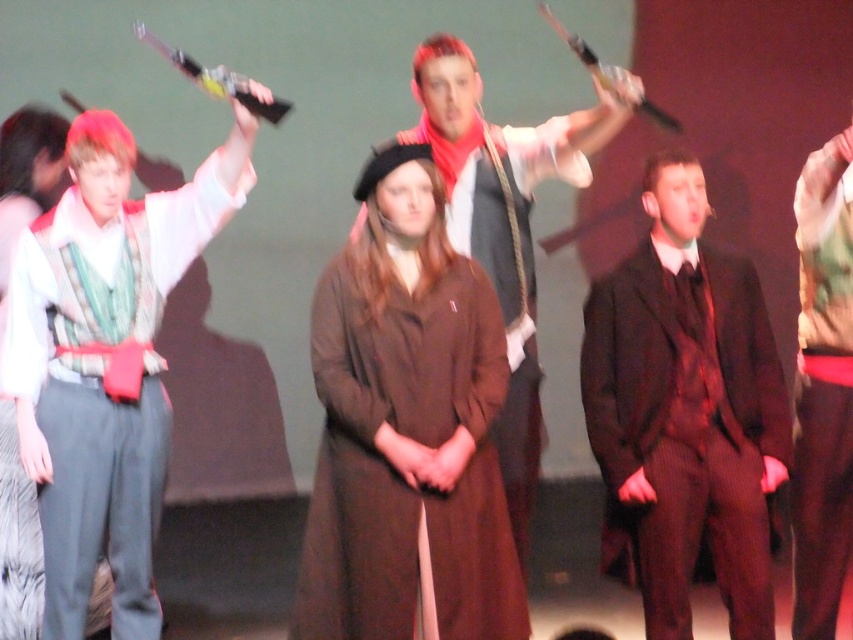
I want to click on matte green vest at left, so 105,358.

Is matte green vest at left to the right of dark brown suit at center from the viewer's perspective?

In fact, matte green vest at left is to the left of dark brown suit at center.

This screenshot has height=640, width=853. I want to click on matte green vest at left, so click(105, 358).

You are a GUI agent. You are given a task and a screenshot of the screen. Output one action in this format:
    pyautogui.click(x=<x>, y=<y>)
    Task: Click on the matte green vest at left
    
    Given the screenshot: What is the action you would take?
    pyautogui.click(x=105, y=358)

Can you confirm if brown woolen coat at center is wider than matte gray vest at center?

No, brown woolen coat at center is not wider than matte gray vest at center.

Who is taller, brown woolen coat at center or matte gray vest at center?

matte gray vest at center

Who is more distant from viewer, (317, 604) or (447, 113)?

Point (447, 113)

Identify the location of brown woolen coat at center. The height and width of the screenshot is (640, 853). (405, 428).

Is dark brown suit at center to the left of matte gray vest at center from the viewer's perspective?

Incorrect, dark brown suit at center is not on the left side of matte gray vest at center.

Is dark brown suit at center bigger than matte gray vest at center?

No.

Is point (675, 522) less distant than point (450, 118)?

That is True.

I want to click on dark brown suit at center, so click(683, 412).